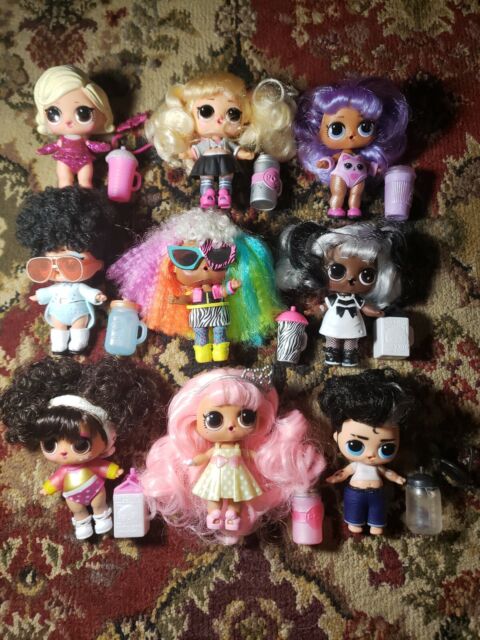
Find the location of a particular element. dolls is located at coordinates (74, 125), (205, 148), (344, 154), (67, 285), (204, 296), (343, 280), (372, 452), (229, 445), (76, 451).